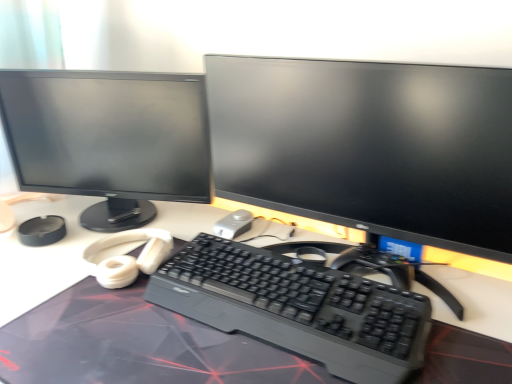
The image size is (512, 384). I want to click on vacant area on top of black matte desk at center (from a real-world perspective), so click(x=152, y=291).